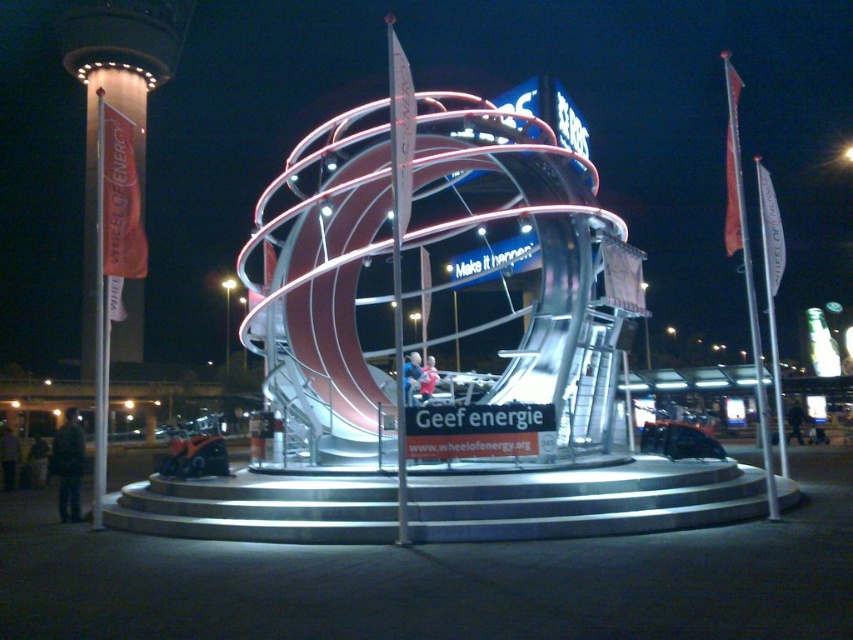
Which is below, white flag at right or orange fabric banner at left?

orange fabric banner at left

Is white flag at right thinner than orange fabric banner at left?

Yes, white flag at right is thinner than orange fabric banner at left.

Where is `white flag at right`? The image size is (853, 640). white flag at right is located at coordinates (746, 268).